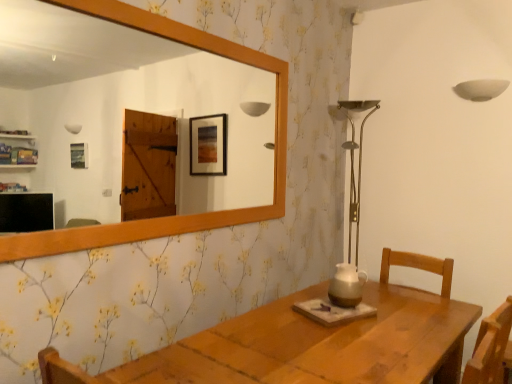
Question: Looking at the image, does brown ceramic pitcher at center seem bigger or smaller compared to wooden mirror at upper center?

Choices:
 (A) small
 (B) big

Answer: (A)

Question: Is brown ceramic pitcher at center taller or shorter than wooden mirror at upper center?

Choices:
 (A) short
 (B) tall

Answer: (A)

Question: From the image's perspective, relative to wooden mirror at upper center, is brown ceramic pitcher at center above or below?

Choices:
 (A) below
 (B) above

Answer: (A)

Question: In terms of width, does wooden mirror at upper center look wider or thinner when compared to brown ceramic pitcher at center?

Choices:
 (A) wide
 (B) thin

Answer: (B)

Question: Is wooden mirror at upper center bigger or smaller than brown ceramic pitcher at center?

Choices:
 (A) small
 (B) big

Answer: (B)

Question: From their relative heights in the image, would you say wooden mirror at upper center is taller or shorter than brown ceramic pitcher at center?

Choices:
 (A) tall
 (B) short

Answer: (A)

Question: From the image's perspective, relative to brown ceramic pitcher at center, is wooden mirror at upper center above or below?

Choices:
 (A) above
 (B) below

Answer: (A)